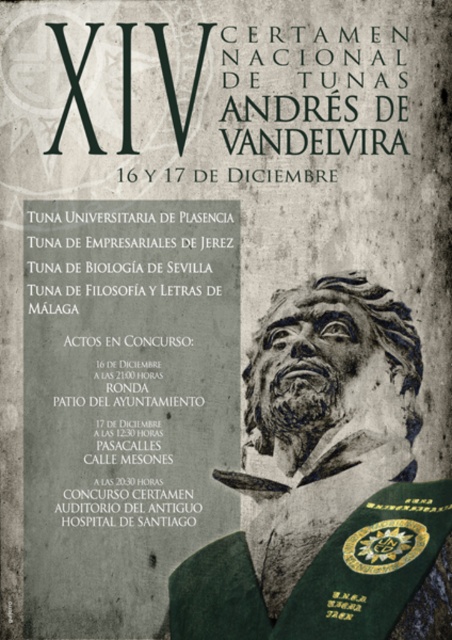
Question: Among these points, which one is farthest from the camera?

Choices:
 (A) (84, 227)
 (B) (169, 582)

Answer: (A)

Question: Does black paper text at upper left have a larger size compared to bronze statue at center?

Choices:
 (A) yes
 (B) no

Answer: (A)

Question: Among these points, which one is farthest from the camera?

Choices:
 (A) (174, 371)
 (B) (287, 380)

Answer: (A)

Question: Does black paper text at upper left have a lesser width compared to bronze statue at center?

Choices:
 (A) no
 (B) yes

Answer: (A)

Question: Can you confirm if black paper text at upper left is positioned to the right of bronze statue at center?

Choices:
 (A) no
 (B) yes

Answer: (A)